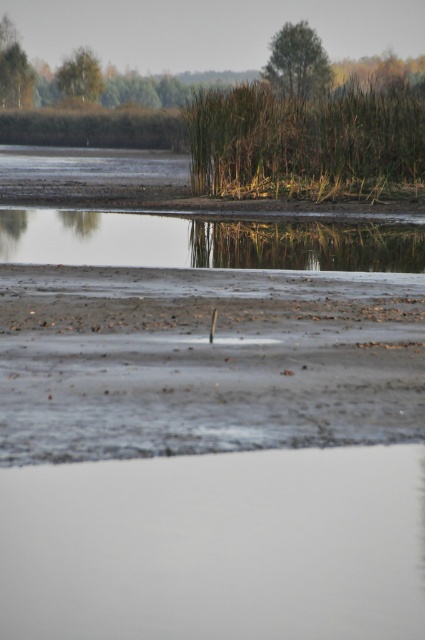
Can you confirm if gray sandy beach at center is wider than smooth reflective water at center?

No.

Between gray sandy beach at center and smooth reflective water at center, which one appears on the right side from the viewer's perspective?

Positioned to the right is gray sandy beach at center.

Is point (13, 336) more distant than point (249, 257)?

No, it is not.

The height and width of the screenshot is (640, 425). Find the location of `gray sandy beach at center`. gray sandy beach at center is located at coordinates (204, 360).

Does brown grass at upper center have a lesser width compared to smooth reflective water at center?

Result: No, brown grass at upper center is not thinner than smooth reflective water at center.

Image resolution: width=425 pixels, height=640 pixels. What do you see at coordinates (306, 141) in the screenshot?
I see `brown grass at upper center` at bounding box center [306, 141].

Find the location of a particular element. This screenshot has height=640, width=425. brown grass at upper center is located at coordinates (306, 141).

Does gray sandy beach at center appear under brown grass at upper center?

Indeed, gray sandy beach at center is positioned under brown grass at upper center.

Does gray sandy beach at center have a lesser height compared to brown grass at upper center?

Indeed, gray sandy beach at center has a lesser height compared to brown grass at upper center.

Is point (31, 387) less distant than point (410, 180)?

Yes, it is in front of point (410, 180).

This screenshot has height=640, width=425. Find the location of `gray sandy beach at center`. gray sandy beach at center is located at coordinates (204, 360).